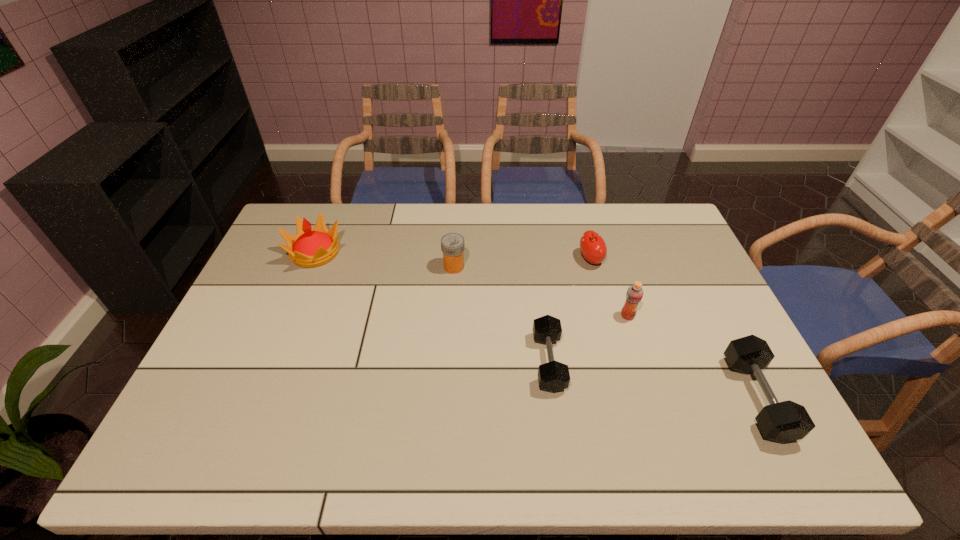
Observe the arrangement of all dumbbells in the image. To keep them evenly spaced, where would you place another dumbbell on the left? Please locate a free space. Please provide its 2D coordinates. Your answer should be formatted as a tuple, i.e. [(x, y)], where the tuple contains the x and y coordinates of a point satisfying the conditions above.

[(367, 330)]